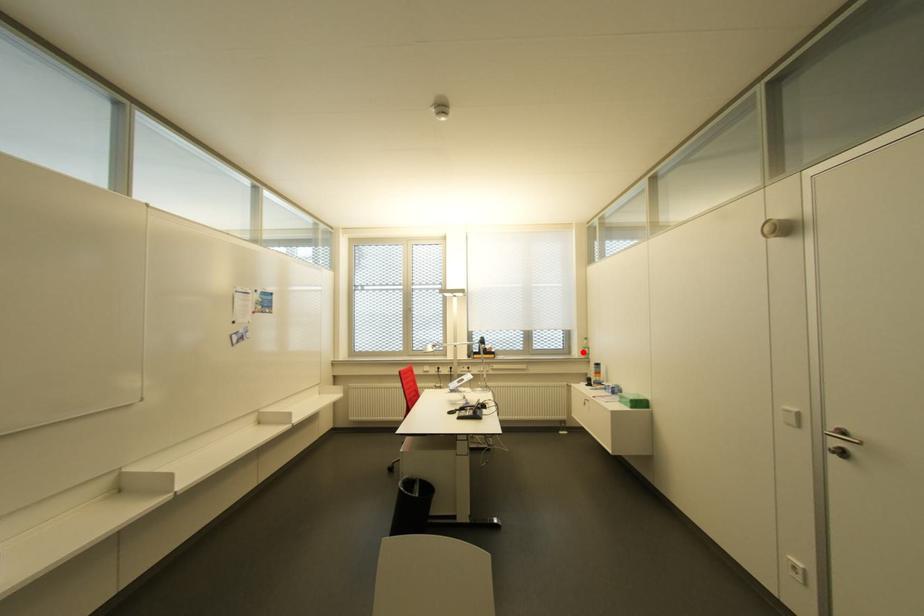
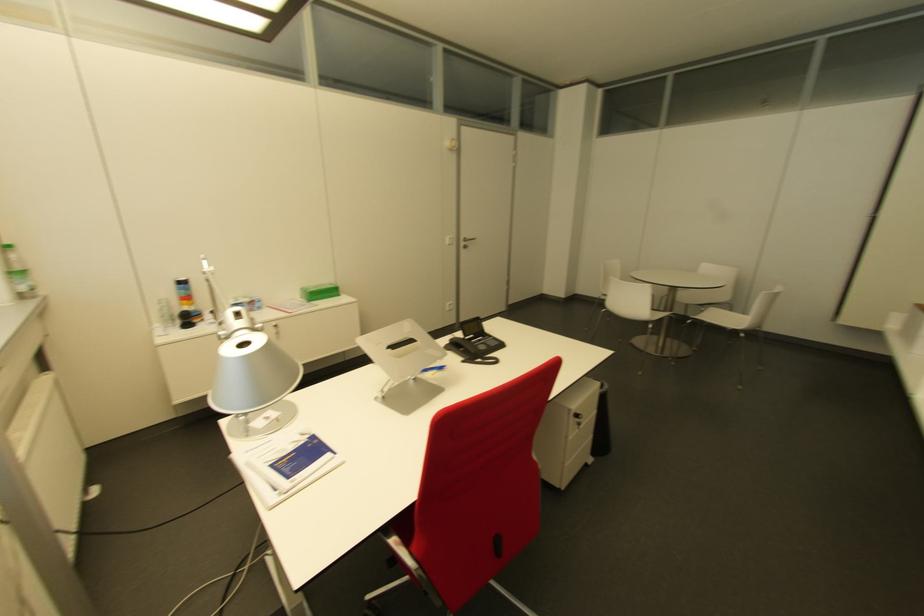
Find the pixel in the second image that matches the highlighted location in the first image.

(27, 284)